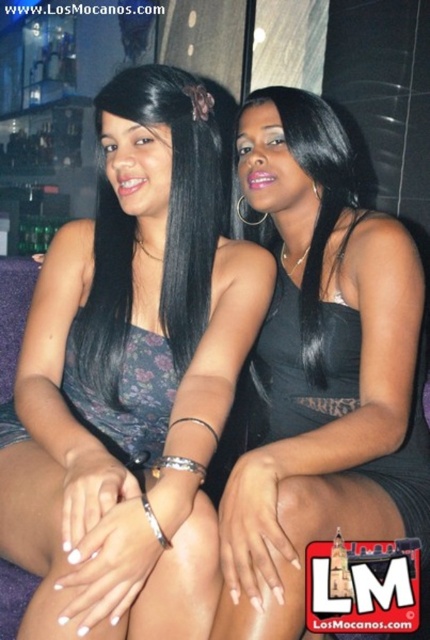
Question: Which point is farther from the camera taking this photo?

Choices:
 (A) (143, 116)
 (B) (337, 138)
 (C) (301, 308)
 (D) (79, 600)

Answer: (B)

Question: Does matte floral dress at center come in front of black silky hair at center?

Choices:
 (A) yes
 (B) no

Answer: (A)

Question: In this image, where is black satin dress at center located relative to black silky hair at left?

Choices:
 (A) below
 (B) above

Answer: (A)

Question: In this image, where is black satin dress at center located relative to black silky hair at left?

Choices:
 (A) right
 (B) left

Answer: (A)

Question: Which point is farther to the camera?

Choices:
 (A) (371, 264)
 (B) (104, 104)

Answer: (A)

Question: Which point is closer to the camera?

Choices:
 (A) black satin dress at center
 (B) matte floral dress at center

Answer: (B)